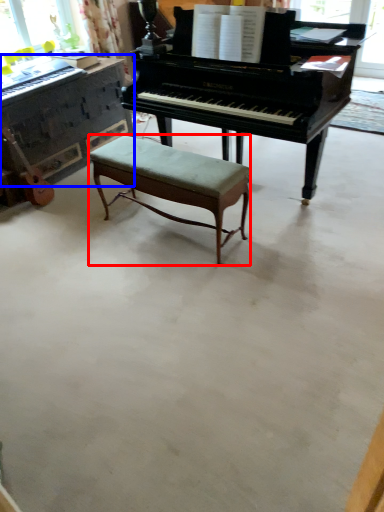
Question: Which object appears closest to the camera in this image, stool (highlighted by a red box) or piano (highlighted by a blue box)?

Choices:
 (A) stool
 (B) piano

Answer: (A)